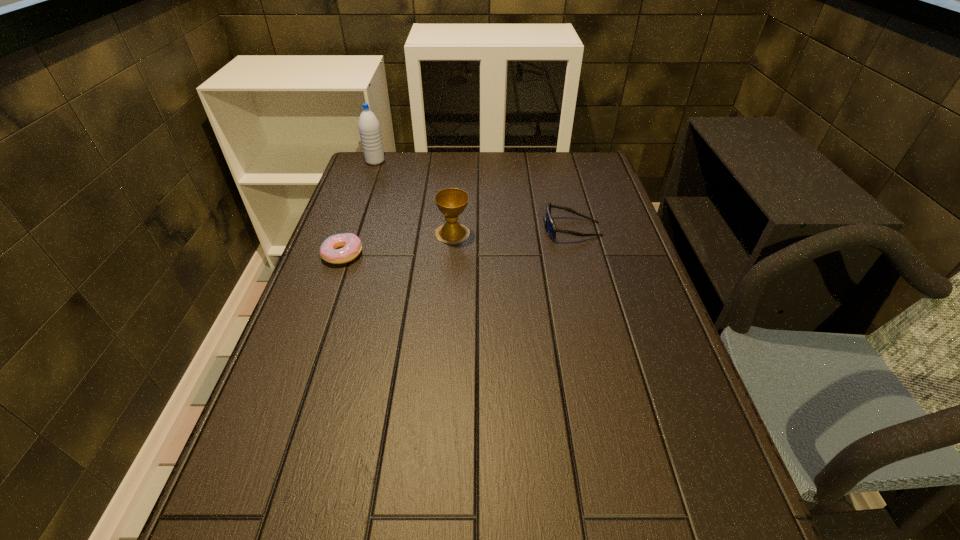
The height and width of the screenshot is (540, 960). I want to click on vacant position in the image that satisfies the following two spatial constraints: 1. on the front-facing side of the rightmost object; 2. on the front side of the chalice, so click(573, 233).

You are a GUI agent. You are given a task and a screenshot of the screen. Output one action in this format:
    pyautogui.click(x=<x>, y=<y>)
    Task: Click on the free point that satisfies the following two spatial constraints: 1. on the front-facing side of the sunglasses; 2. on the front side of the third object from left to right
    The width and height of the screenshot is (960, 540).
    Given the screenshot: What is the action you would take?
    pyautogui.click(x=573, y=233)

Locate an element on the screen. vacant area that satisfies the following two spatial constraints: 1. on the front-facing side of the sunglasses; 2. on the front side of the shortest object is located at coordinates (578, 254).